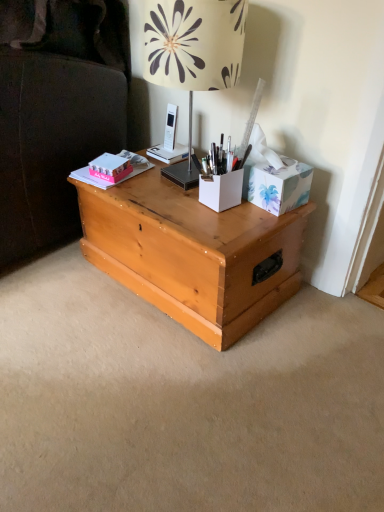
The height and width of the screenshot is (512, 384). I want to click on vacant space to the right of pink matte box at upper left, so click(x=160, y=180).